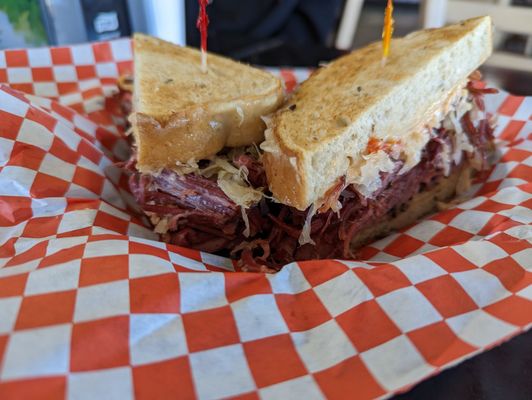
Identify the location of checked paper basket liner. (457, 265).